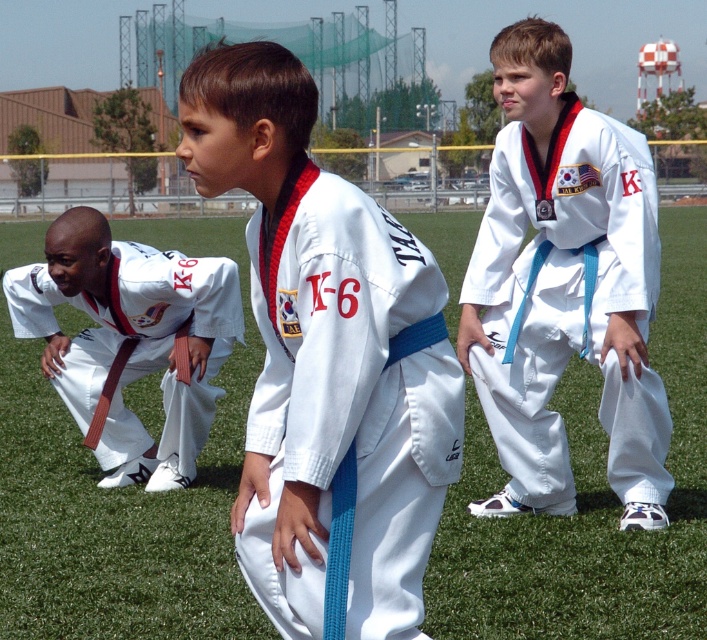
You are a photographer at a Taekwondo event. You need to capture a photo where the white cotton karate uniform at center and the blue fabric pants at center are visible. Based on their heights, which one will appear shorter in the photo?

The white cotton karate uniform at center is not as tall as the blue fabric pants at center, so it will appear shorter in the photo.

You are a photographer taking a picture of the Taekwondo group. You notice two points in the image, point (274, 141) and point (547, 292). Which point is nearer to your camera?

Point (274, 141) is closer to the camera than point (547, 292).

You are a photographer at the Taekwondo event. You need to capture a photo of the white cotton karate uniform at center. The camera is currently focused on point (327, 362). Is the camera focused on the correct location?

Yes, the camera is focused on the correct location because the point (327, 362) corresponds to the white cotton karate uniform at center.